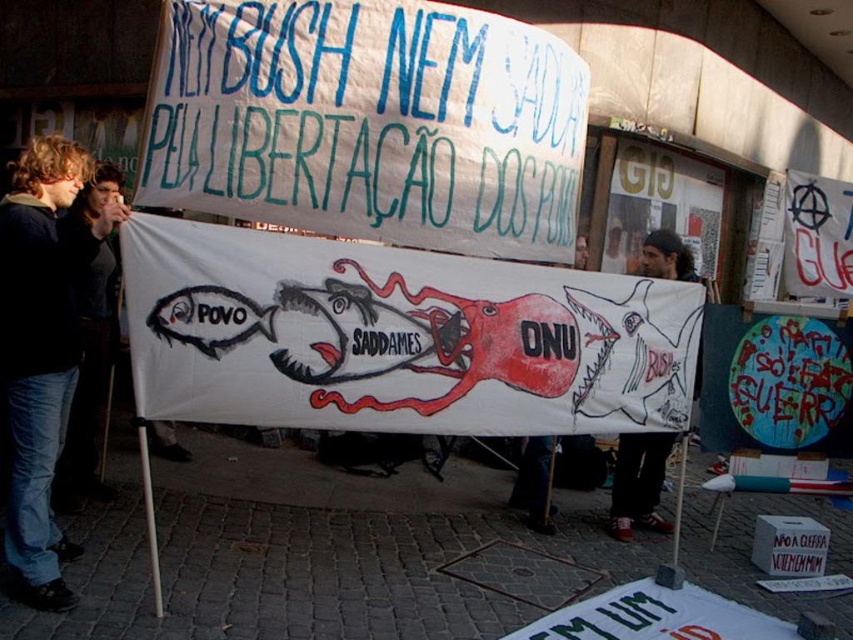
You are a photographer at the protest scene. You want to capture a photo that includes both the white paper banner at center and the dark gray knit cap at upper center. Based on their positions, where should you position the banner in relation to the cap in the frame?

The white paper banner at center is above the dark gray knit cap at upper center, so in the photo, the banner should be positioned higher in the frame than the cap.

You are a journalist taking photos of the protest scene. You need to describe the spatial arrangement between the white paper banner at center and the dark gray knit cap at upper center. Which object is located to the left of the other?

The white paper banner at center is positioned on the left side of dark gray knit cap at upper center.

You are a photographer trying to capture the protest scene. You notice the jeans at left and the dark gray knit cap at upper center. Which object should you focus on first if you want to prioritize capturing taller objects in your frame?

The jeans at left is taller than the dark gray knit cap at upper center, so you should focus on the jeans at left first to prioritize taller objects in your frame.